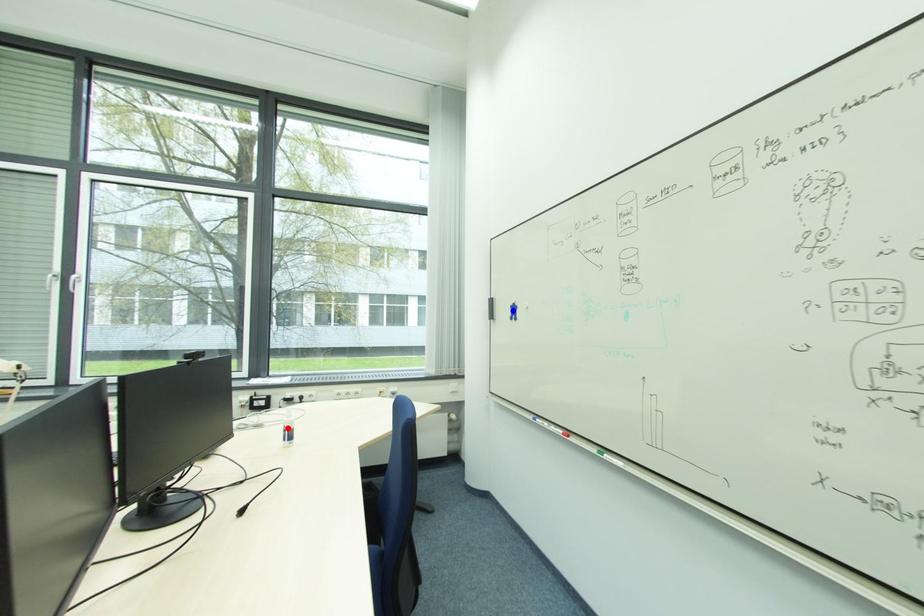
Question: Which of the two points in the image is closer to the camera?

Choices:
 (A) Blue point is closer.
 (B) Red point is closer.

Answer: (A)